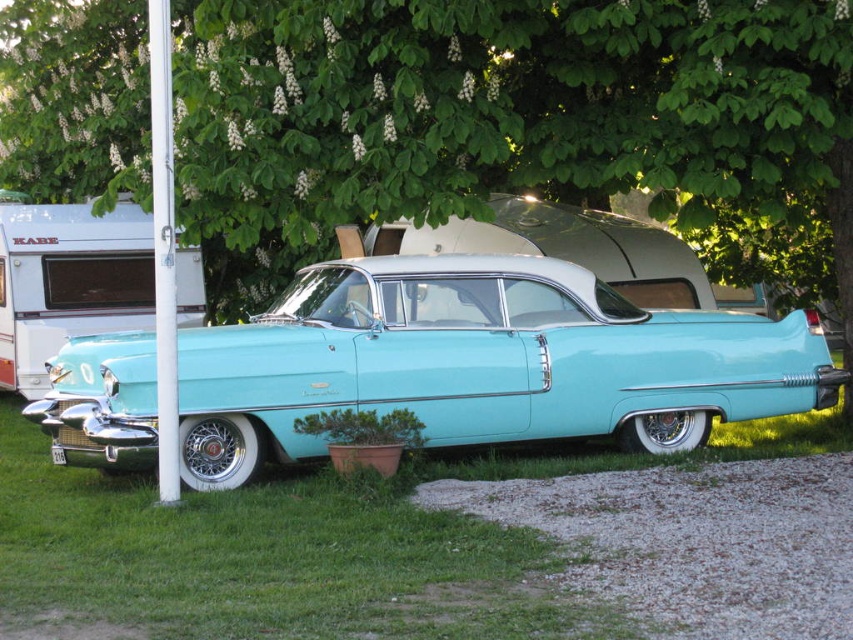
Does green leafy tree at upper center have a lesser height compared to light blue glossy car at center?

Incorrect, green leafy tree at upper center's height does not fall short of light blue glossy car at center's.

Is green leafy tree at upper center thinner than light blue glossy car at center?

In fact, green leafy tree at upper center might be wider than light blue glossy car at center.

Describe the element at coordinates (521, 120) in the screenshot. I see `green leafy tree at upper center` at that location.

Find the location of a particular element. The height and width of the screenshot is (640, 853). green leafy tree at upper center is located at coordinates (521, 120).

Between green leafy tree at upper center and metallic silver trailer at left, which one is positioned lower?

metallic silver trailer at left

Who is more forward, (x=415, y=76) or (x=16, y=252)?

Point (x=415, y=76) is more forward.

The height and width of the screenshot is (640, 853). I want to click on green leafy tree at upper center, so click(x=521, y=120).

Locate an element on the screen. Image resolution: width=853 pixels, height=640 pixels. light blue glossy car at center is located at coordinates (482, 362).

Is light blue glossy car at center smaller than metallic silver trailer at left?

Actually, light blue glossy car at center might be larger than metallic silver trailer at left.

Find the location of a particular element. light blue glossy car at center is located at coordinates (482, 362).